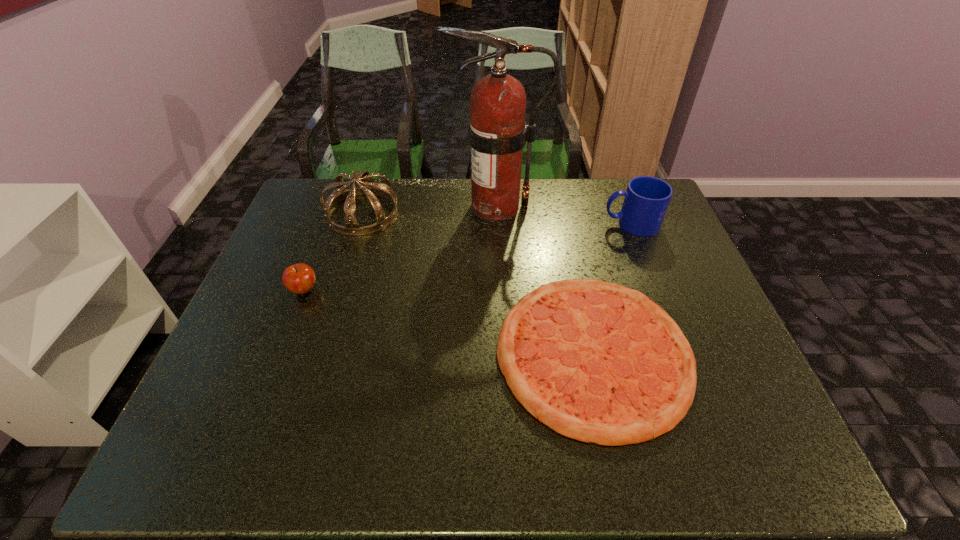
Locate an element on the screen. free space located 0.070m on the side with the handle of the third shortest object is located at coordinates (580, 224).

Where is `free spot located 0.170m on the side with the handle of the third shortest object`? This screenshot has height=540, width=960. free spot located 0.170m on the side with the handle of the third shortest object is located at coordinates (547, 224).

Where is `free space located on the front of the apple`? free space located on the front of the apple is located at coordinates (290, 326).

I want to click on vacant space situated 0.220m on the left of the pizza, so click(401, 353).

This screenshot has width=960, height=540. I want to click on fire extinguisher that is at the far edge, so click(497, 131).

Find the location of a particular element. The height and width of the screenshot is (540, 960). tiara located at the far edge is located at coordinates (367, 187).

You are a GUI agent. You are given a task and a screenshot of the screen. Output one action in this format:
    pyautogui.click(x=<x>, y=<y>)
    Task: Click on the mug present at the far edge
    The image size is (960, 540).
    Given the screenshot: What is the action you would take?
    pyautogui.click(x=646, y=200)

This screenshot has height=540, width=960. What are the coordinates of `object present at the near edge` in the screenshot? It's located at (598, 362).

The height and width of the screenshot is (540, 960). I want to click on tiara that is at the left edge, so click(x=367, y=187).

The width and height of the screenshot is (960, 540). I want to click on apple located in the left edge section of the desktop, so click(x=299, y=278).